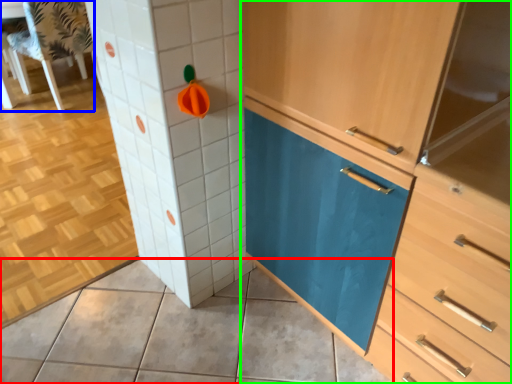
Question: Based on their relative distances, which object is farther from ceramic tile (highlighted by a red box)? Choose from chair (highlighted by a blue box) and cabinetry (highlighted by a green box).

Choices:
 (A) chair
 (B) cabinetry

Answer: (A)